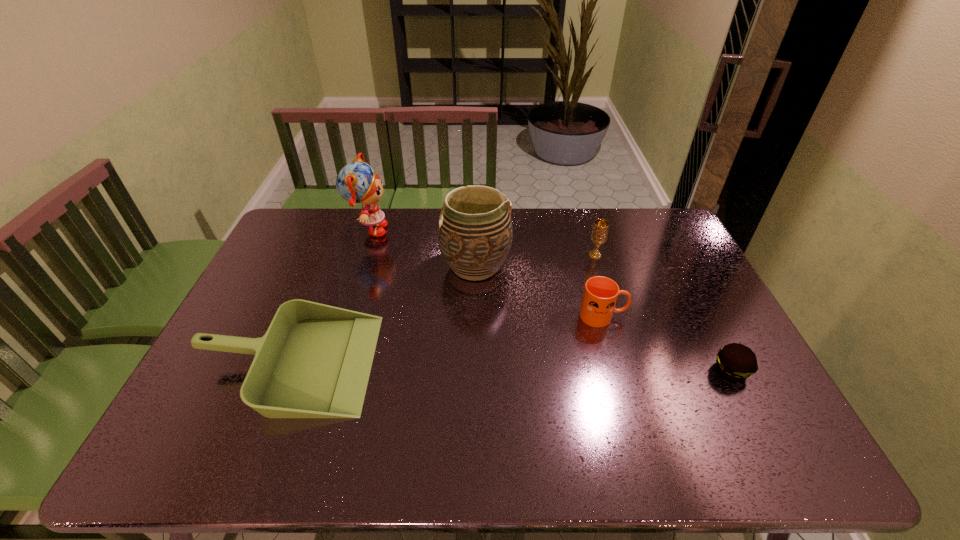
Locate an element on the screen. This screenshot has width=960, height=540. vacant space at the right edge of the desktop is located at coordinates (691, 266).

You are a GUI agent. You are given a task and a screenshot of the screen. Output one action in this format:
    pyautogui.click(x=<x>, y=<y>)
    Task: Click on the vacant space at the far left corner of the desktop
    This screenshot has height=540, width=960.
    Given the screenshot: What is the action you would take?
    pyautogui.click(x=321, y=243)

In the image, there is a desktop. Where is `vacant area at the far right corner`? The height and width of the screenshot is (540, 960). vacant area at the far right corner is located at coordinates (632, 209).

The width and height of the screenshot is (960, 540). Identify the location of blank region between the fourth object from right to left and the dustpan. (382, 314).

The height and width of the screenshot is (540, 960). Identify the location of free space between the dustpan and the chalice. (443, 309).

What are the coordinates of `free space between the fourth object from right to left and the doll` in the screenshot? It's located at (422, 248).

This screenshot has width=960, height=540. I want to click on blank region between the mug and the shortest object, so click(667, 343).

At what (x,y) coordinates should I click in order to perform the action: click on vacant point located between the chalice and the dustpan. Please return your answer as a coordinate pair (x, y). This screenshot has height=540, width=960. Looking at the image, I should click on (443, 309).

The image size is (960, 540). In order to click on vacant point located between the patty and the chalice in this screenshot , I will do `click(663, 313)`.

This screenshot has height=540, width=960. Identify the location of vacant region between the dustpan and the mug. (446, 339).